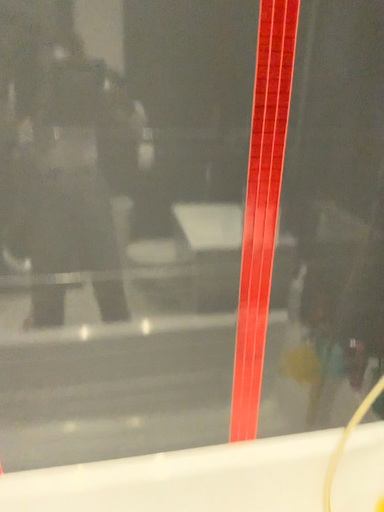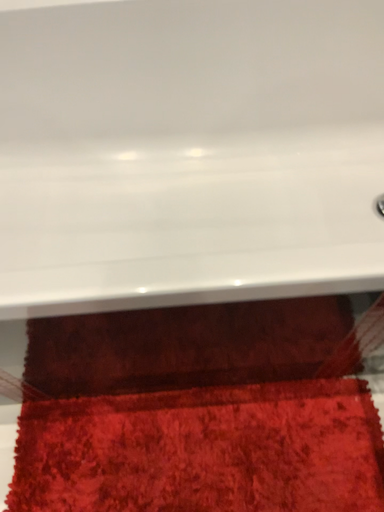
Question: Which way did the camera rotate in the video?

Choices:
 (A) rotated left
 (B) rotated right

Answer: (A)